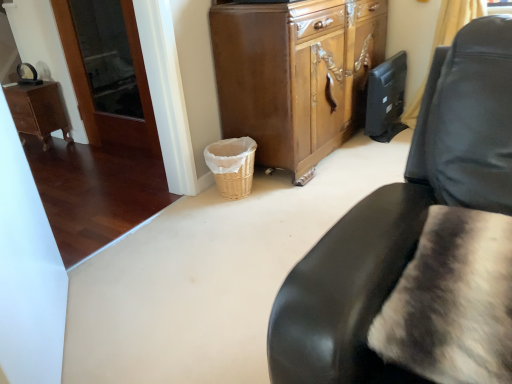
Identify the location of empty space that is to the right of woven wicker basket at lower center. The width and height of the screenshot is (512, 384). (284, 186).